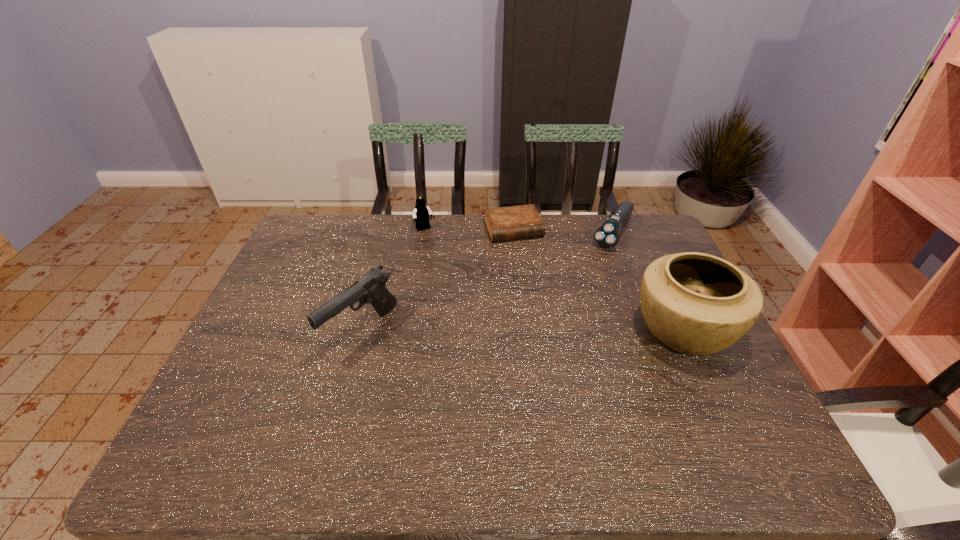
At what (x,y) coordinates should I click in order to perform the action: click on vacant space that's between the fourth shortest object and the Lego. Please return your answer as a coordinate pair (x, y). This screenshot has width=960, height=540. Looking at the image, I should click on (394, 280).

Image resolution: width=960 pixels, height=540 pixels. In order to click on object that is the third closest to the pottery in this screenshot , I will do `click(421, 213)`.

This screenshot has height=540, width=960. Identify the location of object that stands as the second closest to the second tallest object. (524, 221).